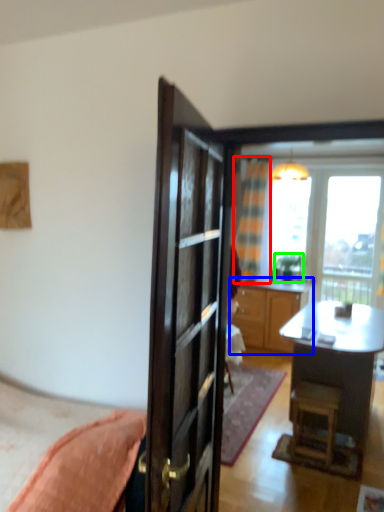
Question: Considering the real-world distances, which object is closest to curtain (highlighted by a red box)? cabinetry (highlighted by a blue box) or houseplant (highlighted by a green box).

Choices:
 (A) cabinetry
 (B) houseplant

Answer: (B)